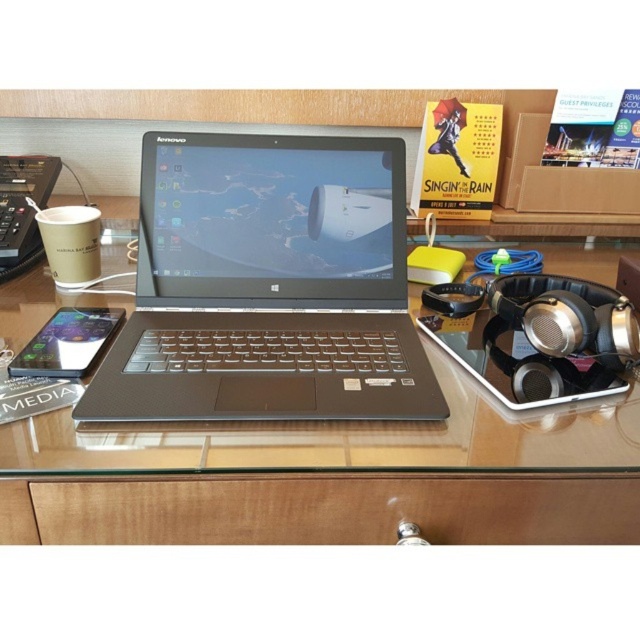
Is satin black phone at lower left wider than brown paper cup at left?

In fact, satin black phone at lower left might be narrower than brown paper cup at left.

Does point (68, 368) come in front of point (72, 220)?

Yes, point (68, 368) is closer to viewer.

Where is `satin black phone at lower left`? satin black phone at lower left is located at coordinates (68, 342).

Is glossy glass desk at center to the left of satin black phone at lower left from the viewer's perspective?

In fact, glossy glass desk at center is to the right of satin black phone at lower left.

Based on the photo, who is lower down, glossy glass desk at center or satin black phone at lower left?

satin black phone at lower left is lower down.

Is point (326, 445) less distant than point (90, 353)?

Yes, it is in front of point (90, 353).

You are a GUI agent. You are given a task and a screenshot of the screen. Output one action in this format:
    pyautogui.click(x=<x>, y=<y>)
    Task: Click on the glossy glass desk at center
    This screenshot has height=640, width=640.
    Given the screenshot: What is the action you would take?
    pyautogui.click(x=330, y=476)

This screenshot has height=640, width=640. What do you see at coordinates (330, 476) in the screenshot?
I see `glossy glass desk at center` at bounding box center [330, 476].

Does glossy glass desk at center have a greater width compared to wooden drawer at lower center?

Correct, the width of glossy glass desk at center exceeds that of wooden drawer at lower center.

Is point (164, 458) positioned after point (336, 524)?

No, it is not.

This screenshot has width=640, height=640. Find the location of `glossy glass desk at center`. glossy glass desk at center is located at coordinates (330, 476).